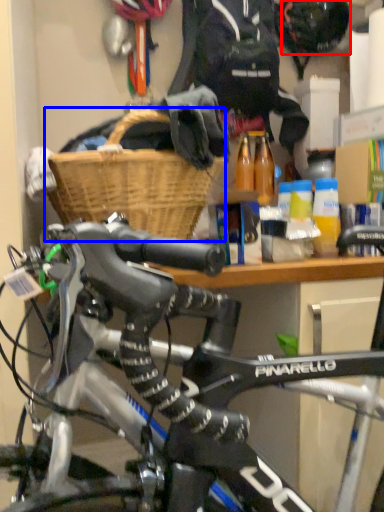
Question: Which object appears farthest to the camera in this image, bicycle helmet (highlighted by a red box) or basket (highlighted by a blue box)?

Choices:
 (A) bicycle helmet
 (B) basket

Answer: (A)